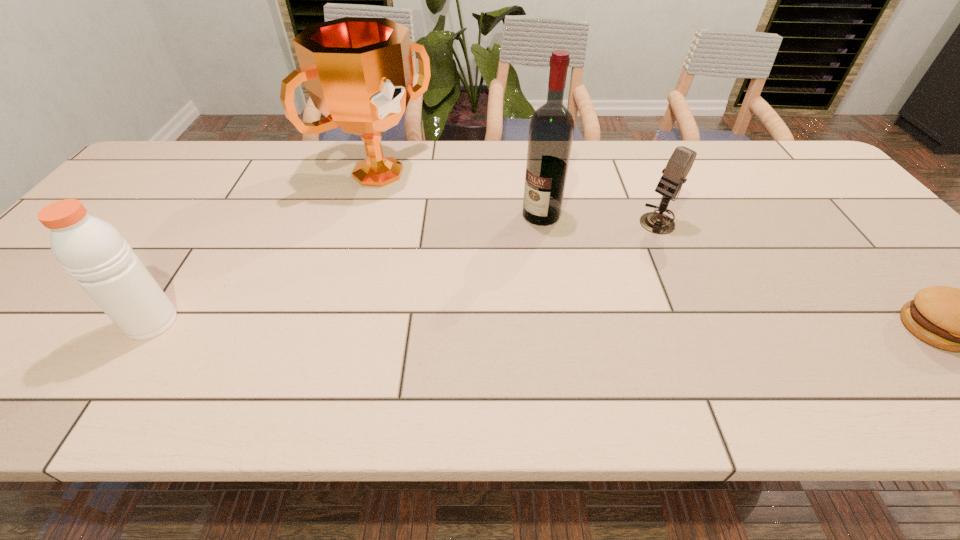
In order to click on free spot located on the front and back of the alcohol in this screenshot , I will do `click(503, 251)`.

Locate an element on the screen. vacant space located on the front-facing side of the fourth tallest object is located at coordinates pyautogui.click(x=549, y=297).

You are a GUI agent. You are given a task and a screenshot of the screen. Output one action in this format:
    pyautogui.click(x=<x>, y=<y>)
    Task: Click on the free spot located 0.180m on the front-facing side of the fourth tallest object
    This screenshot has width=960, height=540.
    Given the screenshot: What is the action you would take?
    pyautogui.click(x=603, y=259)

Identify the location of blank space located 0.310m on the front-facing side of the fourth tallest object. The width and height of the screenshot is (960, 540). tap(567, 285).

What are the coordinates of `free space located 0.290m on the side of the award with the star emblem` in the screenshot? It's located at (476, 246).

The image size is (960, 540). Identify the location of vacant space located on the side of the award with the star emblem. (422, 204).

The width and height of the screenshot is (960, 540). In order to click on vacant space located 0.120m on the side of the award with the star emblem in this screenshot , I will do `click(436, 214)`.

Find the location of a particular element. This screenshot has height=540, width=960. object at the far edge is located at coordinates (358, 71).

This screenshot has width=960, height=540. What are the coordinates of `object that is positioned at the near edge` in the screenshot? It's located at (91, 250).

At what (x,y) coordinates should I click in order to perform the action: click on vacant space at the far edge of the desktop. Please return your answer as a coordinate pair (x, y). This screenshot has height=540, width=960. Looking at the image, I should click on (593, 147).